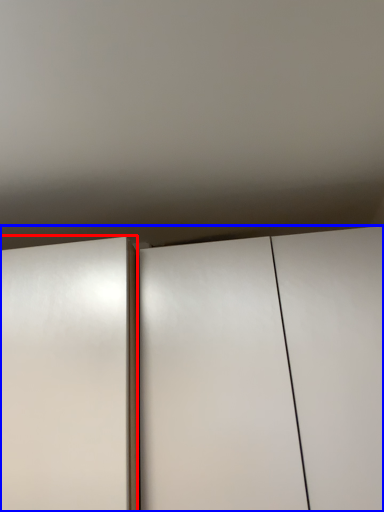
Question: Among these objects, which one is nearest to the camera, door (highlighted by a red box) or cupboard (highlighted by a blue box)?

Choices:
 (A) door
 (B) cupboard

Answer: (A)